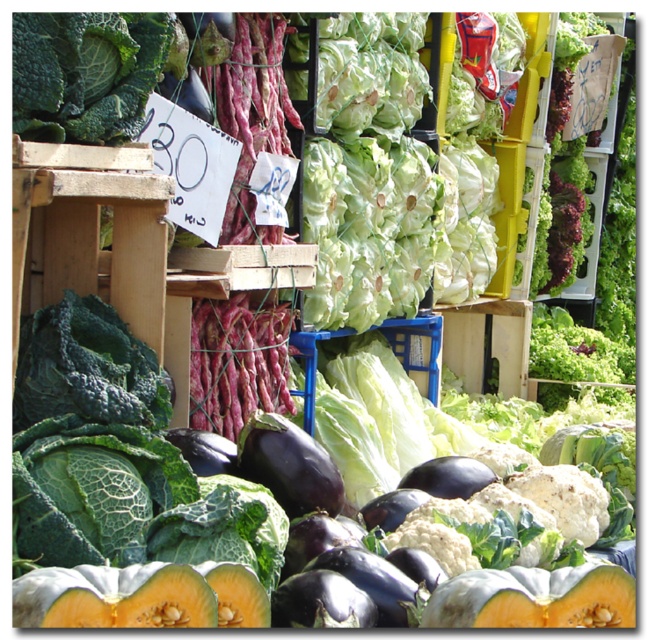
Does orange-fleshed melon at lower left appear on the left side of smooth orange melon at lower center?

Yes, orange-fleshed melon at lower left is to the left of smooth orange melon at lower center.

Is orange-fleshed melon at lower left smaller than smooth orange melon at lower center?

No.

Locate an element on the screen. The image size is (648, 640). orange-fleshed melon at lower left is located at coordinates (141, 596).

Based on the photo, measure the distance from smooth orange melon at lower center to shiny purple eggplant at center.

They are 5.24 feet apart.

Does smooth orange melon at lower center have a greater width compared to shiny purple eggplant at center?

Yes, smooth orange melon at lower center is wider than shiny purple eggplant at center.

Identify the location of smooth orange melon at lower center. The width and height of the screenshot is (648, 640). (535, 598).

Measure the distance between point (259,616) and camera.

A distance of 3.43 meters exists between point (259,616) and camera.

Is point (259, 596) positioned after point (266, 467)?

That is False.

Is point (214, 611) positioned in front of point (332, 488)?

That is True.

Find the location of a particular element. orange-fleshed melon at lower left is located at coordinates (141, 596).